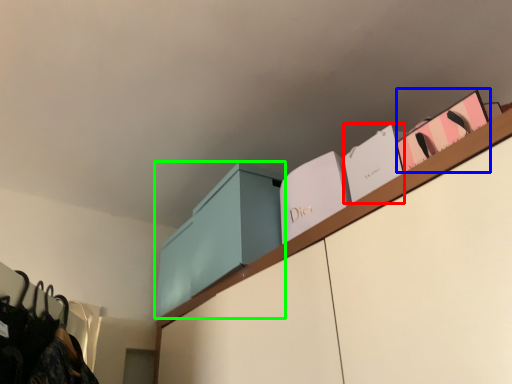
Question: Based on their relative distances, which object is farther from book (highlighted by a red box)? Choose from book (highlighted by a blue box) and cabinetry (highlighted by a green box).

Choices:
 (A) book
 (B) cabinetry

Answer: (B)